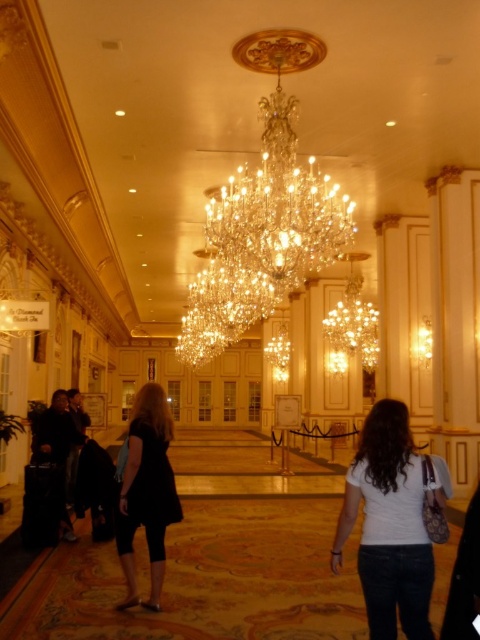
You are a guest at this hotel and want to choose between the white matte shirt at lower right and the black matte dress at center for an evening event. Which one is shorter?

The white matte shirt at lower right is shorter than the black matte dress at center.

You are standing in the hallway and want to find the reception desk. According to the image, where is the white matte shirt at lower right located relative to the reception desk?

The white matte shirt at lower right is located to the right side of the reception desk, which is on the left side of the hallway.

You are a guest in this hallway and want to find the reception desk. You see a point marked at coordinates (388, 525), which is the white matte shirt at lower right. Based on the scene description, where is the reception desk located?

The reception desk is on the left side of the hallway, as mentioned in the scene description, while the white matte shirt at lower right is located at the lower right, so the reception desk is to the left of the white matte shirt at lower right.